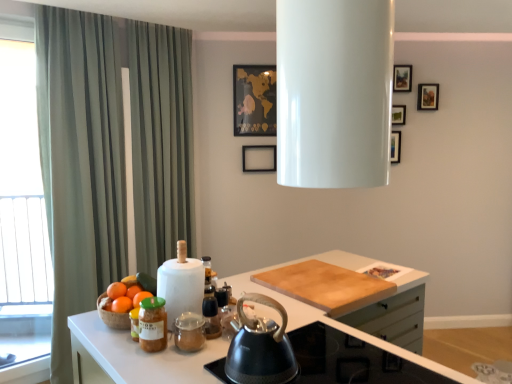
The image size is (512, 384). In order to click on free space in front of matte glass jar at lower left in this screenshot , I will do `click(143, 364)`.